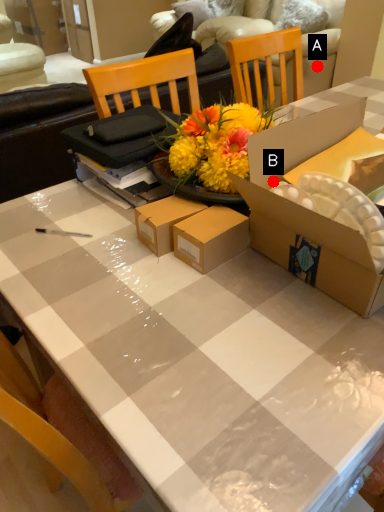
Question: Two points are circled on the image, labeled by A and B beside each circle. Which point is further to the camera?

Choices:
 (A) A is further
 (B) B is further

Answer: (A)